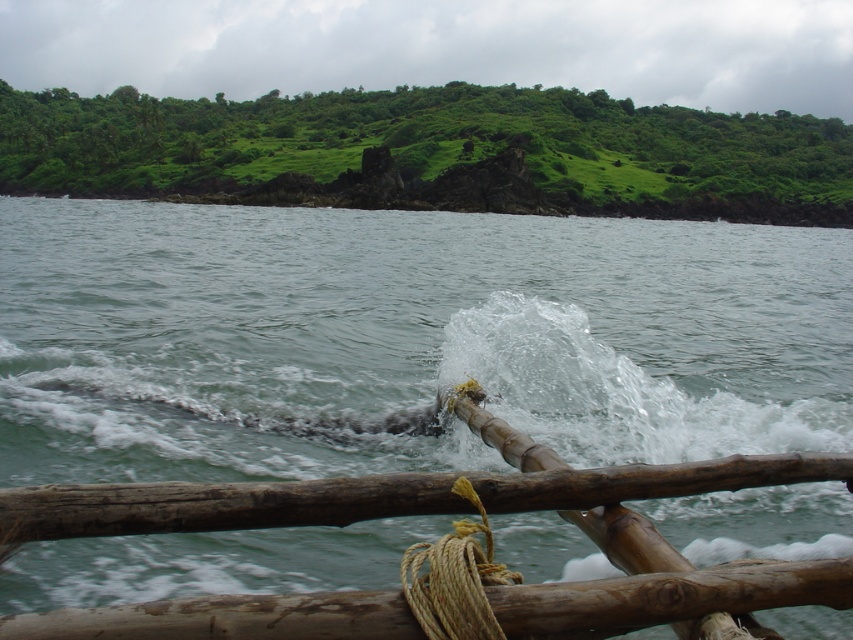
Question: Which point appears farthest from the camera in this image?

Choices:
 (A) (720, 497)
 (B) (485, 604)

Answer: (A)

Question: Is greenish water at center wider than natural tan rope at lower center?

Choices:
 (A) yes
 (B) no

Answer: (A)

Question: Does greenish water at center have a smaller size compared to natural tan rope at lower center?

Choices:
 (A) yes
 (B) no

Answer: (B)

Question: Is greenish water at center bigger than natural tan rope at lower center?

Choices:
 (A) no
 (B) yes

Answer: (B)